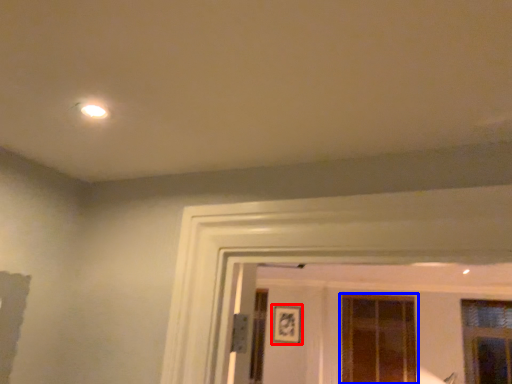
Question: Which of the following is the farthest to the observer, picture frame (highlighted by a red box) or window (highlighted by a blue box)?

Choices:
 (A) picture frame
 (B) window

Answer: (A)